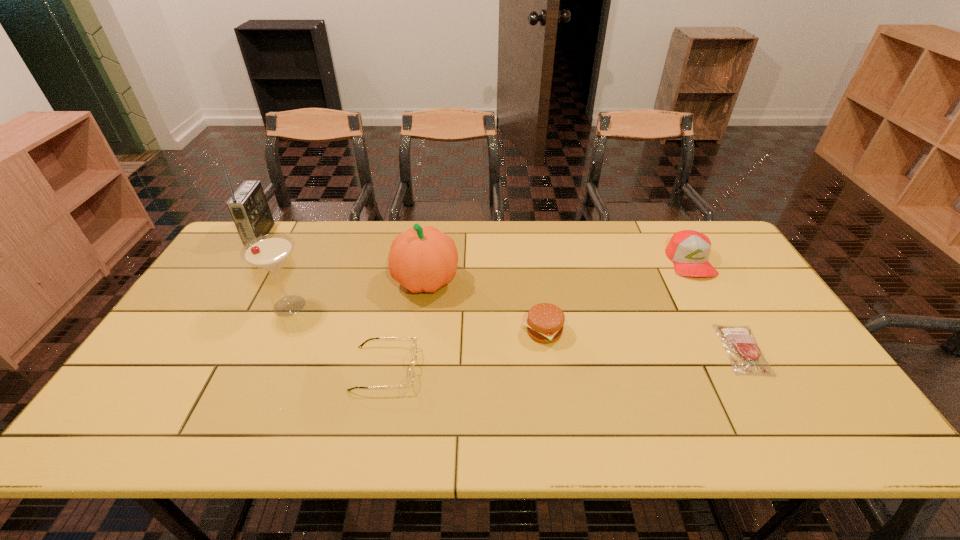
Where is `vacant space situated on the right of the second object from left to right`? vacant space situated on the right of the second object from left to right is located at coordinates (452, 306).

Where is `vacant area situated 0.060m on the left of the pumpkin`? The width and height of the screenshot is (960, 540). vacant area situated 0.060m on the left of the pumpkin is located at coordinates (373, 281).

Identify the location of vacant area situated on the front-facing side of the fourth shortest object. Image resolution: width=960 pixels, height=540 pixels. (708, 292).

Image resolution: width=960 pixels, height=540 pixels. I want to click on free space located 0.120m on the left of the hamburger, so click(478, 332).

This screenshot has width=960, height=540. In order to click on free spot located on the lenses of the spectacles in this screenshot , I will do `click(561, 368)`.

Image resolution: width=960 pixels, height=540 pixels. Find the location of `vacant space located on the back of the shortest object`. vacant space located on the back of the shortest object is located at coordinates (688, 255).

You are a GUI agent. You are given a task and a screenshot of the screen. Output one action in this format:
    pyautogui.click(x=<x>, y=<y>)
    Task: Click on the radio receiver positioned at the far edge
    The height and width of the screenshot is (540, 960).
    Given the screenshot: What is the action you would take?
    pyautogui.click(x=248, y=206)

The image size is (960, 540). In order to click on pumpkin situated at the far edge in this screenshot , I will do `click(421, 259)`.

Identify the location of baseball cap positioned at the far edge. (689, 250).

Find the location of a particular element. Image resolution: width=960 pixels, height=540 pixels. object that is at the left edge is located at coordinates (248, 206).